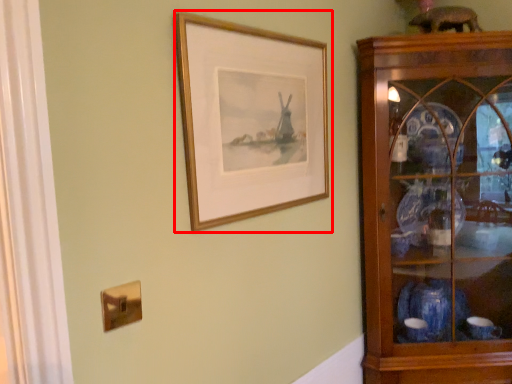
Question: From the image's perspective, where is picture frame (annotated by the red box) located in relation to shelf in the image?

Choices:
 (A) above
 (B) below

Answer: (A)